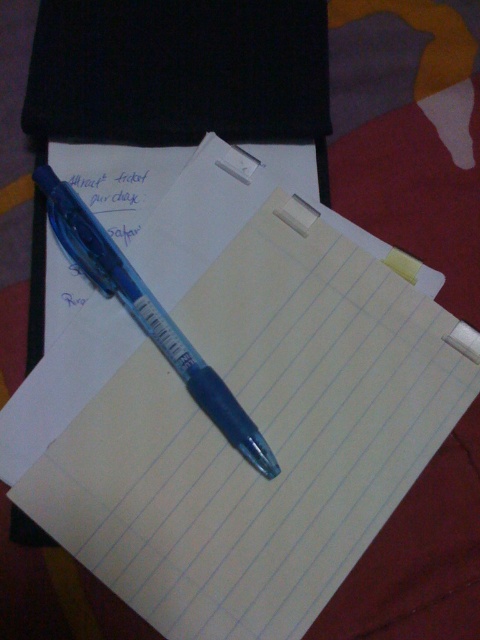
Question: Which point is farther to the camera?

Choices:
 (A) white paper at center
 (B) yellow paper at upper center
 (C) transparent plastic pen at center

Answer: (A)

Question: Can you confirm if white paper at center is wider than yellow paper at upper center?

Choices:
 (A) no
 (B) yes

Answer: (B)

Question: Is transparent plastic pen at center smaller than yellow paper at upper center?

Choices:
 (A) no
 (B) yes

Answer: (A)

Question: Observing the image, what is the correct spatial positioning of transparent plastic pen at center in reference to white paper at center?

Choices:
 (A) above
 (B) below

Answer: (B)

Question: Among these objects, which one is nearest to the camera?

Choices:
 (A) white paper at center
 (B) transparent plastic pen at center

Answer: (B)

Question: Which of these objects is positioned farthest from the white paper at center?

Choices:
 (A) transparent plastic pen at center
 (B) yellow paper at upper center

Answer: (A)